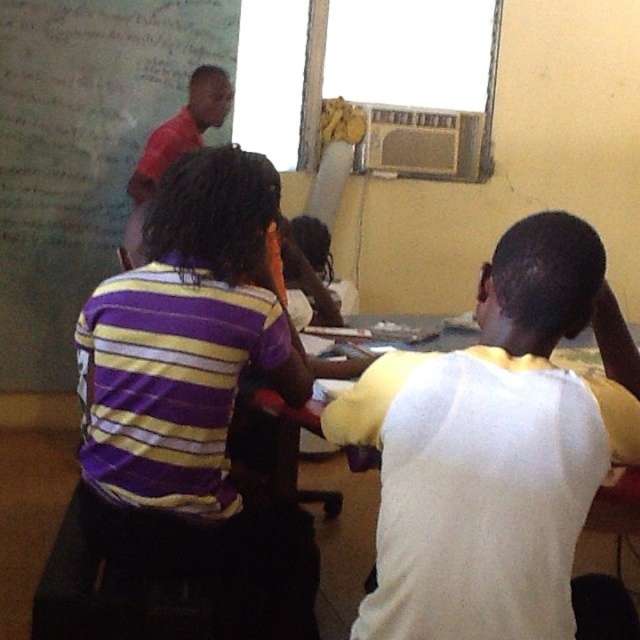
Question: Considering the real-world distances, which object is farthest from the red shirt at upper left?

Choices:
 (A) white/yellow raglan sleeve shirt at center
 (B) whiteboard at upper left

Answer: (A)

Question: Is whiteboard at upper left to the left of red shirt at upper left from the viewer's perspective?

Choices:
 (A) no
 (B) yes

Answer: (B)

Question: In this image, where is white/yellow raglan sleeve shirt at center located relative to red shirt at upper left?

Choices:
 (A) above
 (B) below

Answer: (B)

Question: In this image, where is whiteboard at upper left located relative to red shirt at upper left?

Choices:
 (A) left
 (B) right

Answer: (A)

Question: Which of the following is the farthest from the observer?

Choices:
 (A) whiteboard at upper left
 (B) white/yellow raglan sleeve shirt at center

Answer: (A)

Question: Considering the real-world distances, which object is farthest from the whiteboard at upper left?

Choices:
 (A) white/yellow raglan sleeve shirt at center
 (B) red shirt at upper left

Answer: (A)